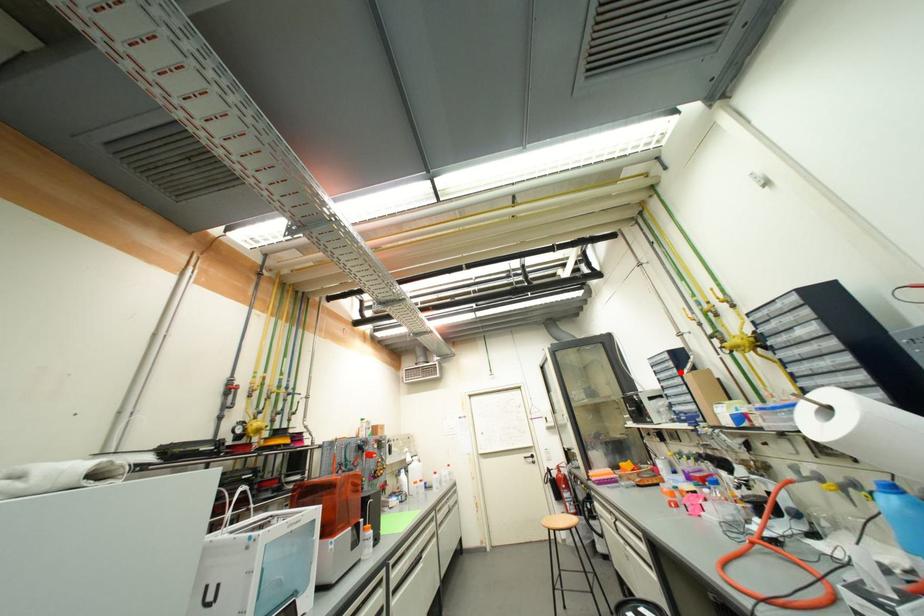
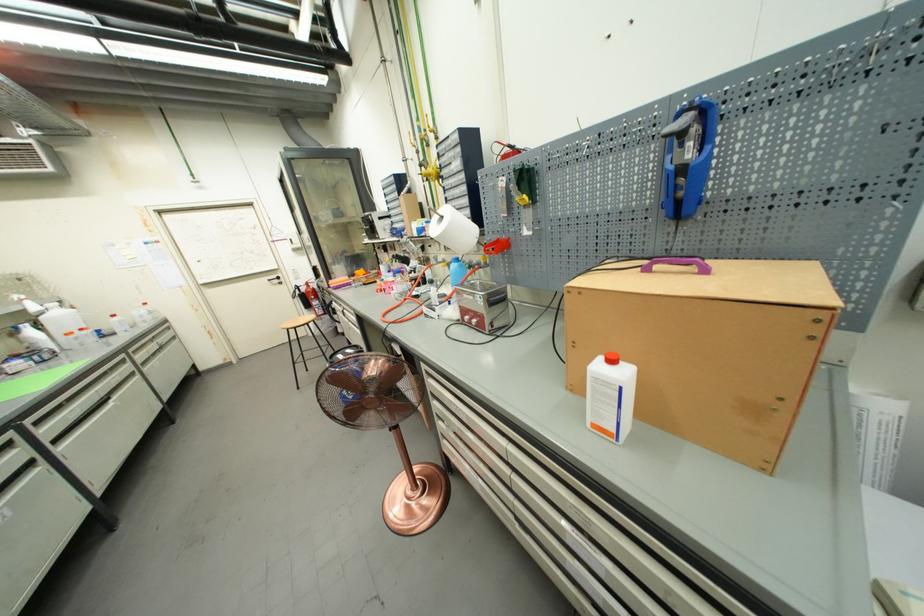
Question: I am providing you with two images of the same scene from different viewpoints. Image1 has a red point marked. In image2, the corresponding 3D location appears at what relative position? Reply with the corresponding letter.

Choices:
 (A) Closer
 (B) Farther

Answer: (A)